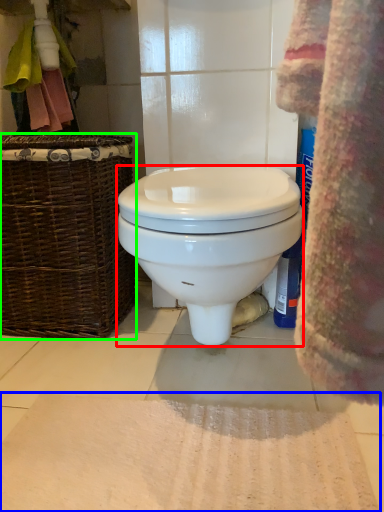
Question: Based on their relative distances, which object is nearer to toilet (highlighted by a red box)? Choose from bath mat (highlighted by a blue box) and picnic basket (highlighted by a green box).

Choices:
 (A) bath mat
 (B) picnic basket

Answer: (B)